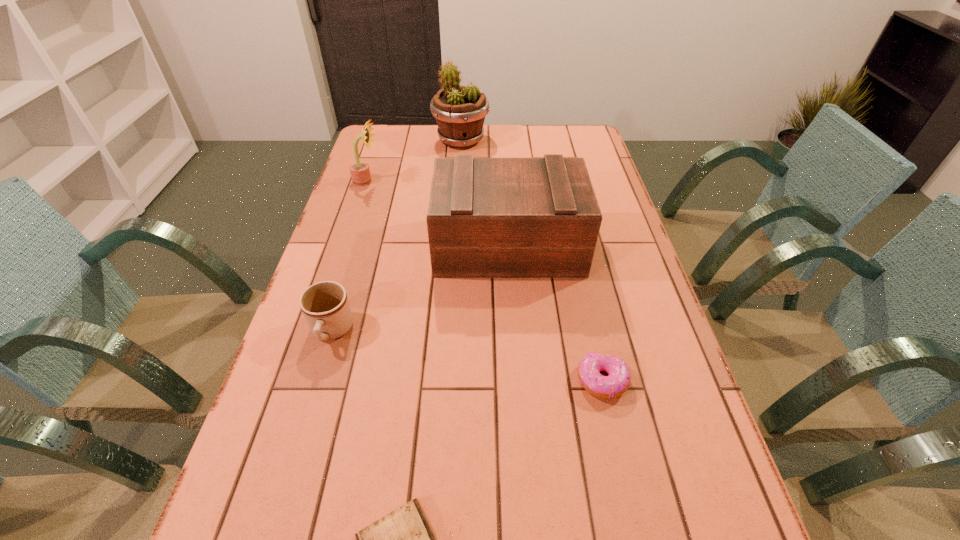
This screenshot has height=540, width=960. I want to click on the farthest object, so click(x=460, y=111).

Find the location of a particular element. The height and width of the screenshot is (540, 960). flowerpot is located at coordinates (460, 111).

Identify the location of box. The height and width of the screenshot is (540, 960). (487, 217).

The image size is (960, 540). In order to click on sunflower in this screenshot , I will do `click(360, 173)`.

Image resolution: width=960 pixels, height=540 pixels. I want to click on mug, so click(x=325, y=306).

This screenshot has width=960, height=540. In order to click on the third nearest object in this screenshot , I will do `click(325, 306)`.

Locate an element on the screen. The width and height of the screenshot is (960, 540). doughnut is located at coordinates (617, 382).

Locate an element on the screen. This screenshot has width=960, height=540. the second nearest object is located at coordinates (617, 382).

Image resolution: width=960 pixels, height=540 pixels. Find the location of `free space located 0.360m on the right of the tallest object`. free space located 0.360m on the right of the tallest object is located at coordinates (583, 140).

Image resolution: width=960 pixels, height=540 pixels. In order to click on vacant space located 0.260m on the left of the box in this screenshot , I will do `click(346, 246)`.